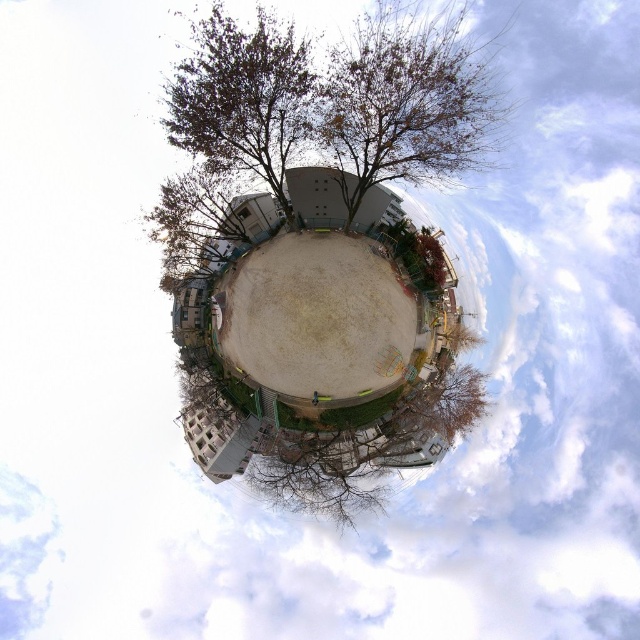
Question: Can you confirm if brown leafy tree at center is wider than brown leafy tree at upper center?

Choices:
 (A) no
 (B) yes

Answer: (B)

Question: Estimate the real-world distances between objects in this image. Which object is closer to the brown leafy tree at center?

Choices:
 (A) bare branches at center
 (B) brown leafy tree at upper center

Answer: (B)

Question: Does brown leafy tree at center appear under brown leafy tree at upper center?

Choices:
 (A) no
 (B) yes

Answer: (A)

Question: Which of the following is the closest to the observer?

Choices:
 (A) bare branches at center
 (B) brown leafy tree at upper center
 (C) brown leafy tree at center

Answer: (C)

Question: Which object appears farthest from the camera in this image?

Choices:
 (A) bare branches at center
 (B) brown leafy tree at upper center
 (C) brown leafy tree at center

Answer: (A)

Question: From the image, what is the correct spatial relationship of brown leafy tree at center in relation to bare branches at center?

Choices:
 (A) right
 (B) left

Answer: (A)